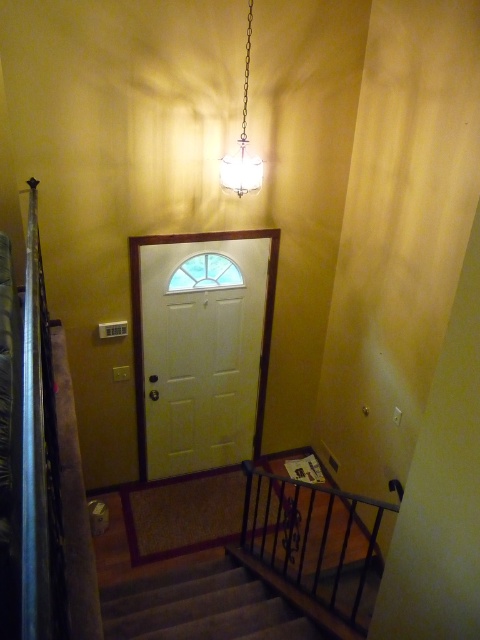
You are standing at the entrance of the hallway and want to go upstairs. Where are the carpeted stairs at center located relative to you?

The carpeted stairs at center are located at point (x=201, y=605) in the hallway.

You are moving a 1.2 meter wide sofa through the hallway and need to navigate around the black metal balustrade at lower right and the carpeted stairs at center. Which object should you avoid hitting to ensure the sofa fits through the space?

The black metal balustrade at lower right has a lesser width compared to carpeted stairs at center, so you should avoid hitting the black metal balustrade at lower right since it is narrower and may restrict the sofa passage more closely.